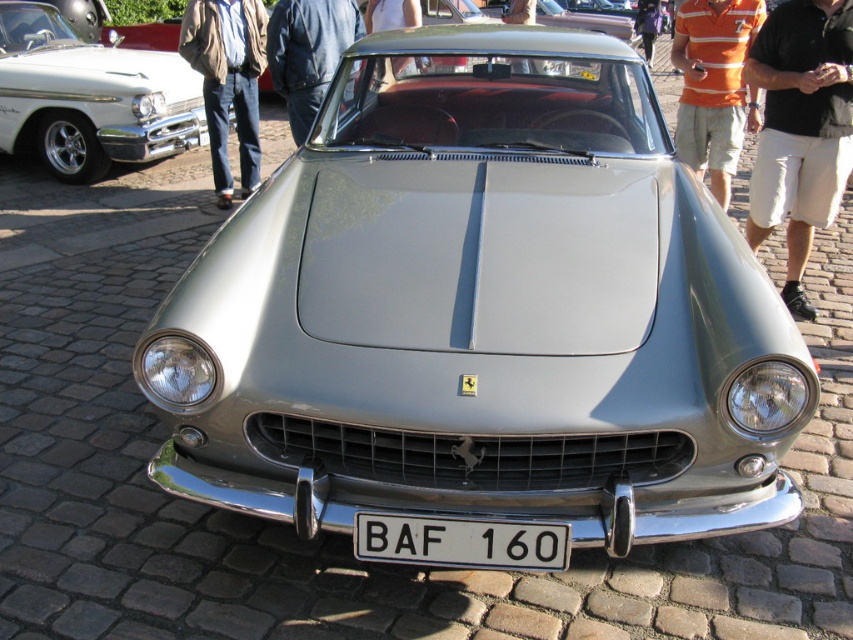
Does point (148, 60) come closer to viewer compared to point (294, 32)?

No.

Can you confirm if white glossy sedan at left is taller than dark blue leather jacket at center?

Indeed, white glossy sedan at left has a greater height compared to dark blue leather jacket at center.

Which is behind, point (24, 54) or point (306, 80)?

The point (24, 54) is more distant.

The width and height of the screenshot is (853, 640). Identify the location of white glossy sedan at left. (90, 97).

Is white glossy sedan at left thinner than orange striped polo shirt at upper center?

No.

Does point (173, 113) lie in front of point (724, 157)?

No, (173, 113) is further to viewer.

In order to click on white glossy sedan at left in this screenshot , I will do `click(90, 97)`.

Between white glossy sedan at left and white plastic license plate at center, which one is positioned higher?

Positioned higher is white glossy sedan at left.

Can you confirm if white glossy sedan at left is shorter than white plastic license plate at center?

No.

What do you see at coordinates (90, 97) in the screenshot? This screenshot has height=640, width=853. I see `white glossy sedan at left` at bounding box center [90, 97].

Locate an element on the screen. The height and width of the screenshot is (640, 853). white glossy sedan at left is located at coordinates (90, 97).